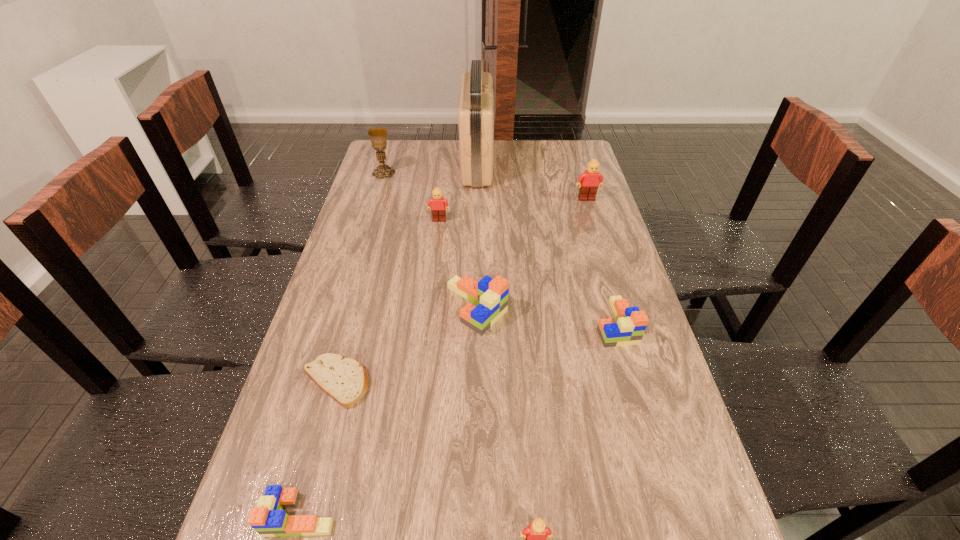
Choose which Lego is the fourth nearest neighbor to the second orange Lego from right to left. Please provide its 2D coordinates. Your answer should be formatted as a tuple, i.e. [(x, y)], where the tuple contains the x and y coordinates of a point satisfying the conditions above.

[(535, 534)]

You are a GUI agent. You are given a task and a screenshot of the screen. Output one action in this format:
    pyautogui.click(x=<x>, y=<y>)
    Task: Click on the brown Lego that is the third closest to the third nearest object
    The image size is (960, 540).
    Given the screenshot: What is the action you would take?
    pyautogui.click(x=589, y=181)

Identify which brown Lego is located as the nearest to the nearest brown Lego. Please provide its 2D coordinates. Your answer should be formatted as a tuple, i.e. [(x, y)], where the tuple contains the x and y coordinates of a point satisfying the conditions above.

[(438, 210)]

Identify the location of orange Lego that stands as the second closest to the rightmost orange Lego. (268, 519).

In order to click on orange Lego object that ranks as the third closest to the fourth object from left to right in this screenshot , I will do `click(268, 519)`.

Locate an element on the screen. This screenshot has width=960, height=540. free point that satisfies the following two spatial constraints: 1. on the face of the second smallest brown Lego; 2. on the left side of the rightmost orange Lego is located at coordinates (428, 323).

I want to click on vacant space that satisfies the following two spatial constraints: 1. on the front-facing side of the tallest object; 2. on the left side of the rightmost orange Lego, so click(x=475, y=323).